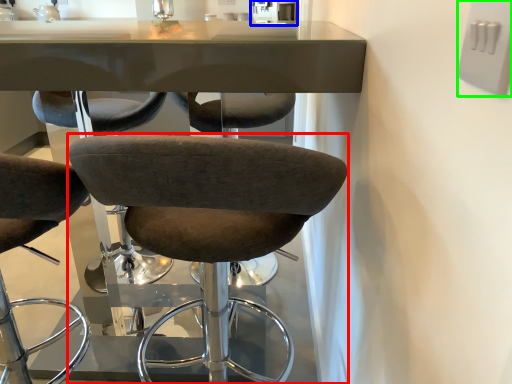
Question: Which object is positioned closest to chair (highlighted by a red box)? Select from sink (highlighted by a blue box) and electric outlet (highlighted by a green box).

Choices:
 (A) sink
 (B) electric outlet

Answer: (B)